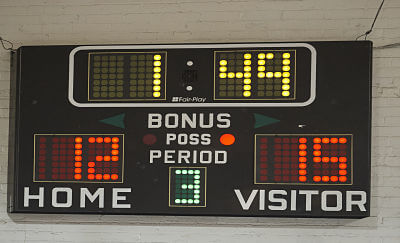
I want to click on speaker, so click(186, 72).